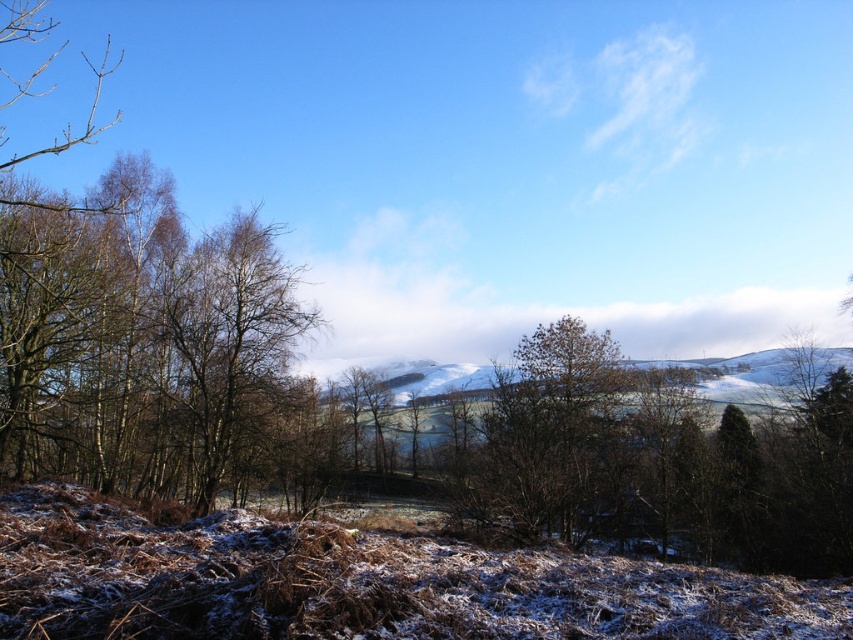
Based on the photo, can you confirm if brown bark tree at left is thinner than brown textured tree at center?

No.

Is point (50, 436) closer to viewer compared to point (535, 417)?

Yes, it is in front of point (535, 417).

At what (x,y) coordinates should I click in order to perform the action: click on brown bark tree at left. Please return your answer as a coordinate pair (x, y). Looking at the image, I should click on (141, 340).